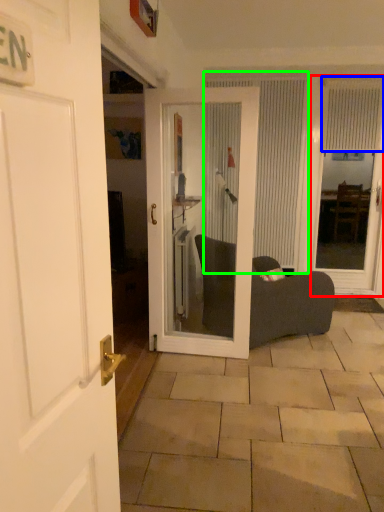
Question: Which object is the closest to the glass door (highlighted by a red box)? Choose among these: curtain (highlighted by a blue box) or curtain (highlighted by a green box).

Choices:
 (A) curtain
 (B) curtain

Answer: (A)